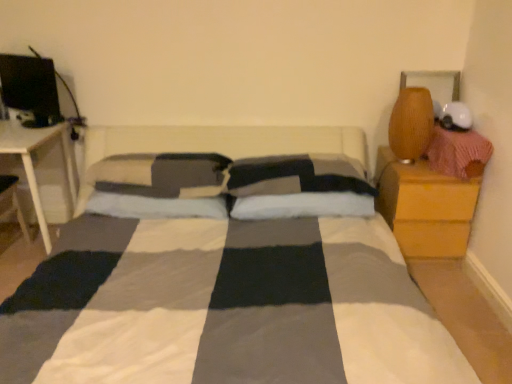
Question: Choose the correct answer: Is matte black monitor at upper left inside soft gray pillow at center, which is counted as the second pillow, starting from the left, or outside it?

Choices:
 (A) outside
 (B) inside

Answer: (A)

Question: Relative to soft gray pillow at center, which is the 3th pillow in right-to-left order, is matte black monitor at upper left in front or behind?

Choices:
 (A) front
 (B) behind

Answer: (B)

Question: Considering the real-world distances, which object is farthest from the matte brown vase at upper right?

Choices:
 (A) white soft pillow at center, which ranks as the first pillow in right-to-left order
 (B) white wood table at left
 (C) soft gray pillow at center, marked as the first pillow in a left-to-right arrangement
 (D) matte black monitor at upper left
 (E) soft gray pillow at center, which is the 3th pillow in right-to-left order

Answer: (D)

Question: Estimate the real-world distances between objects in this image. Which object is farther from the matte brown vase at upper right?

Choices:
 (A) soft gray pillow at center, which is counted as the second pillow, starting from the left
 (B) wooden nightstand at right
 (C) white soft pillow at center, which is the 4th pillow in left-to-right order
 (D) white wood table at left
 (E) checkered fabric pillow at center, acting as the 3th pillow starting from the left

Answer: (D)